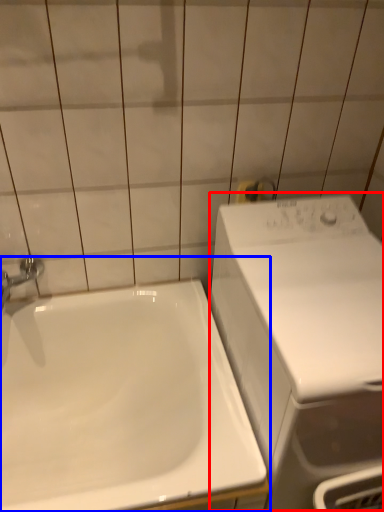
Question: Which point is closer to the camera, washing machine (highlighted by a red box) or sink (highlighted by a blue box)?

Choices:
 (A) washing machine
 (B) sink

Answer: (A)